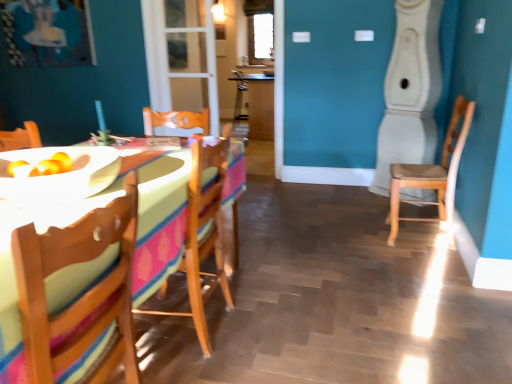
Question: Is wooden chair at center, the second chair viewed from the left, located within wooden chair at right, which ranks as the first chair in back-to-front order?

Choices:
 (A) yes
 (B) no

Answer: (B)

Question: Can you confirm if wooden chair at right, which ranks as the first chair in back-to-front order, is bigger than wooden chair at center, placed as the 2th chair when sorted from right to left?

Choices:
 (A) yes
 (B) no

Answer: (B)

Question: Considering the relative sizes of wooden chair at right, which ranks as the first chair in back-to-front order, and wooden chair at center, which ranks as the 2th chair in back-to-front order, in the image provided, is wooden chair at right, which ranks as the first chair in back-to-front order, shorter than wooden chair at center, which ranks as the 2th chair in back-to-front order,?

Choices:
 (A) no
 (B) yes

Answer: (B)

Question: From a real-world perspective, is wooden chair at right, the 3th chair viewed from the front, positioned under wooden chair at center, placed as the 2th chair when sorted from right to left, based on gravity?

Choices:
 (A) no
 (B) yes

Answer: (A)

Question: From a real-world perspective, is wooden chair at right, the 3th chair viewed from the front, positioned over wooden chair at center, the second chair in the front-to-back sequence, based on gravity?

Choices:
 (A) no
 (B) yes

Answer: (B)

Question: Is wooden table at left inside the boundaries of white glossy bowl at center, or outside?

Choices:
 (A) outside
 (B) inside

Answer: (A)

Question: From the image's perspective, is wooden table at left positioned above or below white glossy bowl at center?

Choices:
 (A) above
 (B) below

Answer: (B)

Question: Is wooden table at left in front of or behind white glossy bowl at center in the image?

Choices:
 (A) front
 (B) behind

Answer: (A)

Question: In terms of width, does wooden table at left look wider or thinner when compared to white glossy bowl at center?

Choices:
 (A) wide
 (B) thin

Answer: (A)

Question: Is point (x=253, y=16) closer or farther from the camera than point (x=237, y=99)?

Choices:
 (A) closer
 (B) farther

Answer: (B)

Question: From a real-world perspective, relative to wooden table at center, is clear glass window at upper center vertically above or below?

Choices:
 (A) below
 (B) above

Answer: (B)

Question: From the image's perspective, is clear glass window at upper center located above or below wooden table at center?

Choices:
 (A) above
 (B) below

Answer: (A)

Question: Looking at their shapes, would you say clear glass window at upper center is wider or thinner than wooden table at center?

Choices:
 (A) wide
 (B) thin

Answer: (B)

Question: Relative to wooden table at center, is transparent glass door at center in front or behind?

Choices:
 (A) front
 (B) behind

Answer: (A)

Question: From a real-world perspective, is transparent glass door at center positioned above or below wooden table at center?

Choices:
 (A) above
 (B) below

Answer: (A)